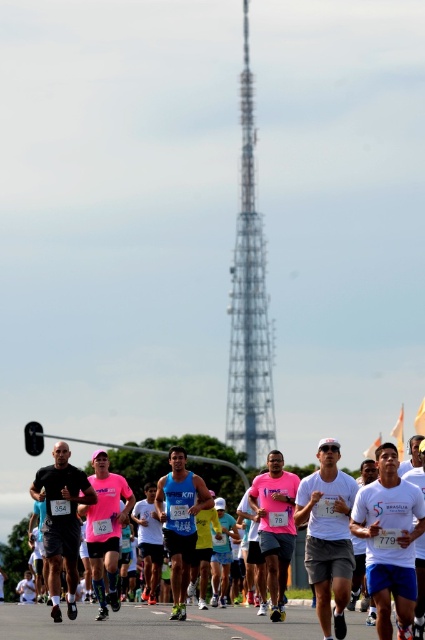
Question: Which of the following is the closest to the observer?

Choices:
 (A) (388, 614)
 (B) (241, 294)

Answer: (A)

Question: Does metallic silver tower at center have a greater width compared to white matte shirt at center?

Choices:
 (A) yes
 (B) no

Answer: (B)

Question: Does metallic silver tower at center have a smaller size compared to white matte shirt at center?

Choices:
 (A) yes
 (B) no

Answer: (A)

Question: Is metallic silver tower at center positioned in front of white matte shirt at center?

Choices:
 (A) yes
 (B) no

Answer: (B)